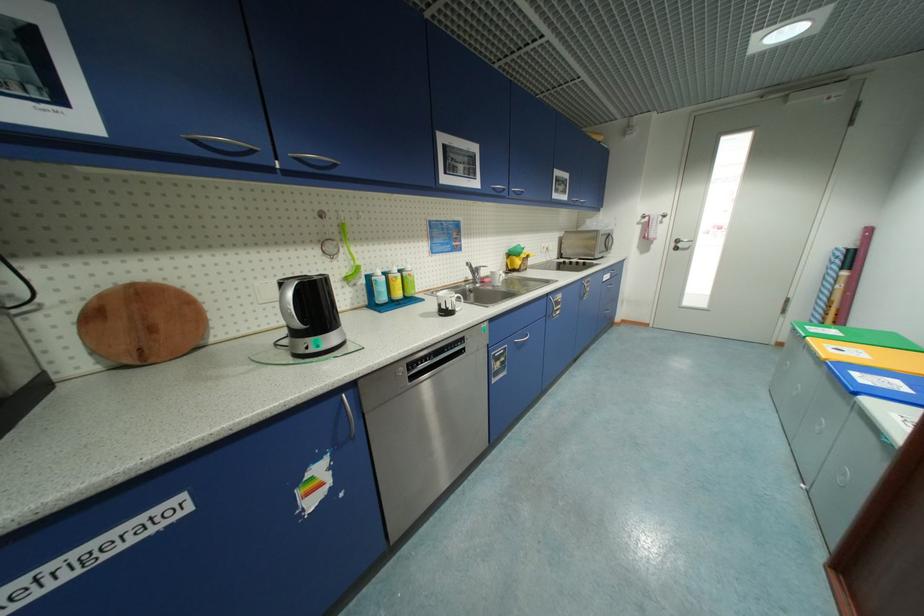
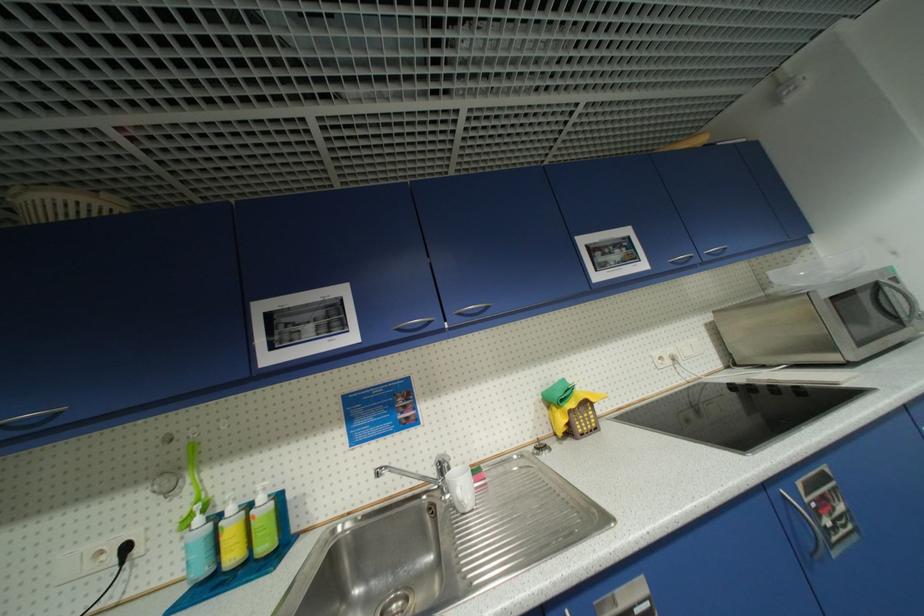
In the second image, find the point that corresponds to [499,190] in the first image.

(405, 331)